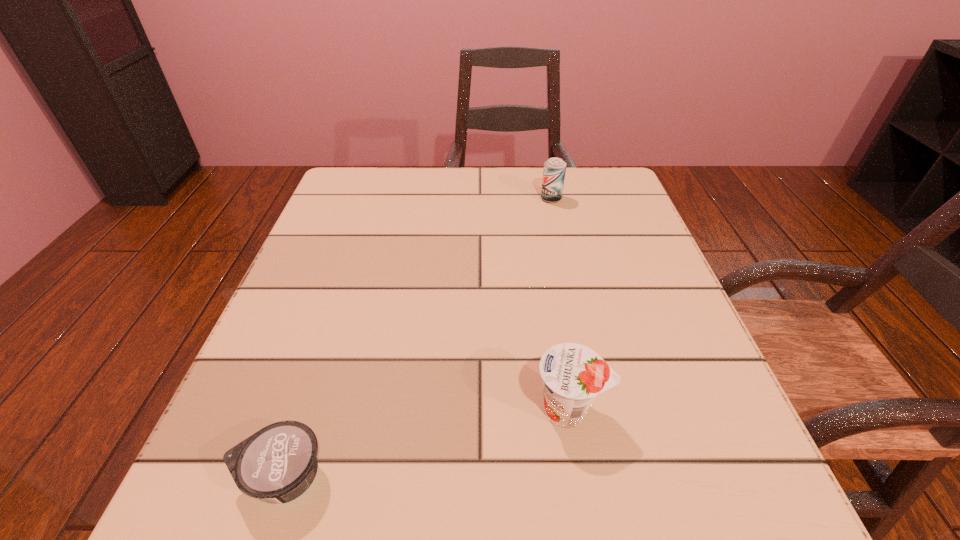
The image size is (960, 540). Identify the location of free spot between the nearest object and the beer can. (417, 338).

Where is `unoccupied position between the farthest object and the right yogurt`? This screenshot has height=540, width=960. unoccupied position between the farthest object and the right yogurt is located at coordinates (560, 304).

This screenshot has width=960, height=540. Find the location of `vacant point located between the shortest object and the farthest object`. vacant point located between the shortest object and the farthest object is located at coordinates click(417, 338).

Where is `free space between the farthest object and the left yogurt`? The height and width of the screenshot is (540, 960). free space between the farthest object and the left yogurt is located at coordinates (417, 338).

This screenshot has width=960, height=540. I want to click on vacant area that lies between the farther yogurt and the farthest object, so click(x=560, y=304).

Identify the location of vacant space that is in between the beer can and the nearer yogurt. The image size is (960, 540). (417, 338).

Find the location of a particular element. vacant area between the beer can and the leftmost object is located at coordinates (417, 338).

In order to click on free space between the nearer yogurt and the beer can in this screenshot , I will do `click(417, 338)`.

Find the location of a particular element. The image size is (960, 540). free area in between the shortest object and the farther yogurt is located at coordinates (426, 444).

Identify the location of object that stands as the closest to the nearer yogurt. The image size is (960, 540). (573, 375).